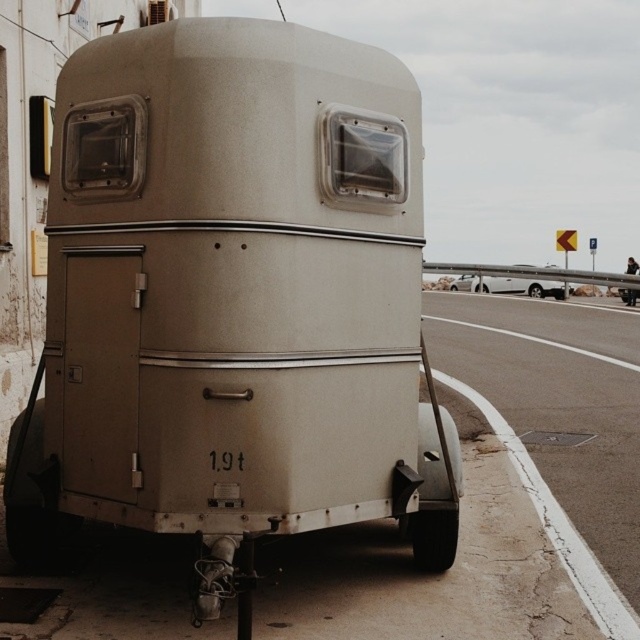
Question: Does matte beige trailer truck at center appear on the right side of asphalt road at lower right?

Choices:
 (A) no
 (B) yes

Answer: (A)

Question: Which of the following is the farthest from the observer?

Choices:
 (A) matte beige trailer truck at center
 (B) asphalt road at lower right

Answer: (B)

Question: Which of the following is the closest to the observer?

Choices:
 (A) matte white trailer at center
 (B) matte beige trailer truck at center

Answer: (B)

Question: Which object appears farthest from the camera in this image?

Choices:
 (A) matte white trailer at center
 (B) asphalt road at lower right
 (C) matte beige trailer truck at center

Answer: (A)

Question: Can you confirm if matte beige trailer truck at center is positioned below asphalt road at lower right?

Choices:
 (A) no
 (B) yes

Answer: (A)

Question: Does matte beige trailer truck at center appear on the left side of matte white trailer at center?

Choices:
 (A) no
 (B) yes

Answer: (B)